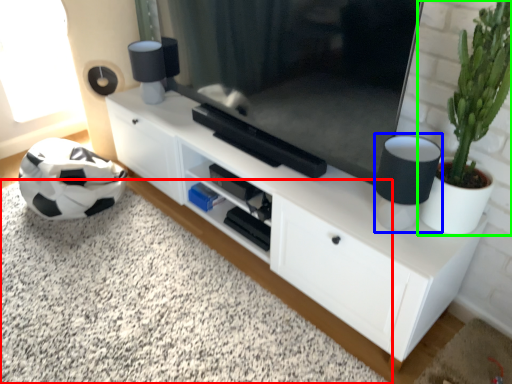
Question: Which object is the farthest from plain (highlighted by a red box)? Choose among these: lamp (highlighted by a blue box) or houseplant (highlighted by a green box).

Choices:
 (A) lamp
 (B) houseplant

Answer: (B)